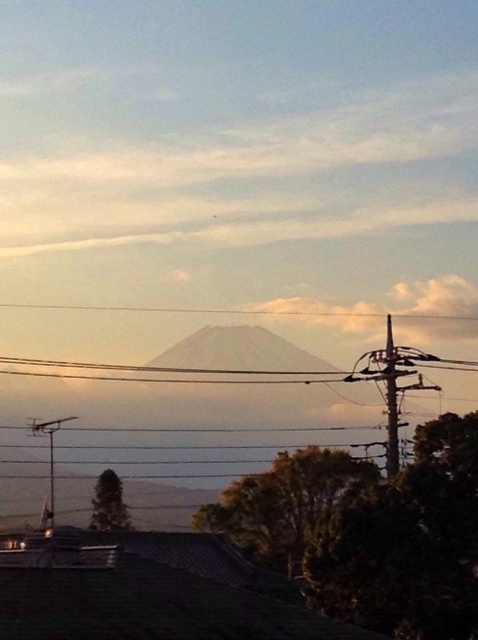
You are an architect designing a new communication tower that needs to be visible from the base of the mountain. Given the current scene, how does the size of the metallic gray telegraph pole at left compare to the white fluffy cloud at upper center?

The white fluffy cloud at upper center is larger than the metallic gray telegraph pole at left, so the telegraph pole may not be as visible from the mountain base compared to the cloud.

You are standing at the point with coordinates point [397,445] and want to walk towards the point with coordinates point [52,515]. According to the scene, will you be moving towards the foreground or the background?

Since point [397,445] is in front of point [52,515], moving from point [397,445] towards point [52,515] would mean moving towards the background.

You are an architect designing a new communication tower that needs to be as wide as the white fluffy cloud at upper center. You see the metallic gray telegraph pole at left in the image. Can the tower be wider than the pole?

The white fluffy cloud at upper center is wider than the metallic gray telegraph pole at left, so yes, the tower can be wider than the pole.